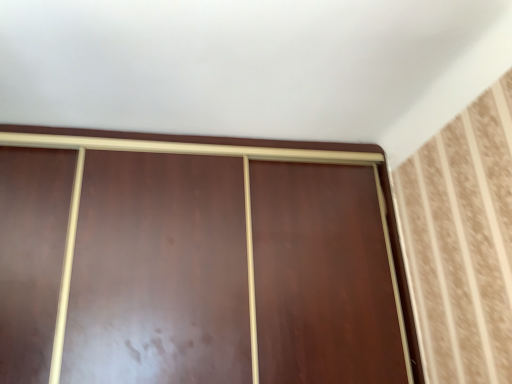
Where is `matte wood door at center`? This screenshot has width=512, height=384. matte wood door at center is located at coordinates coord(265,160).

The image size is (512, 384). Describe the element at coordinates (265, 160) in the screenshot. I see `matte wood door at center` at that location.

Locate an element on the screen. The image size is (512, 384). matte wood door at center is located at coordinates (265, 160).